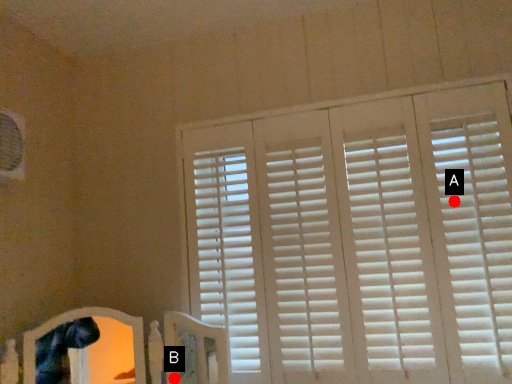
Question: Two points are circled on the image, labeled by A and B beside each circle. Which of the following is the farthest from the observer?

Choices:
 (A) A is further
 (B) B is further

Answer: (B)